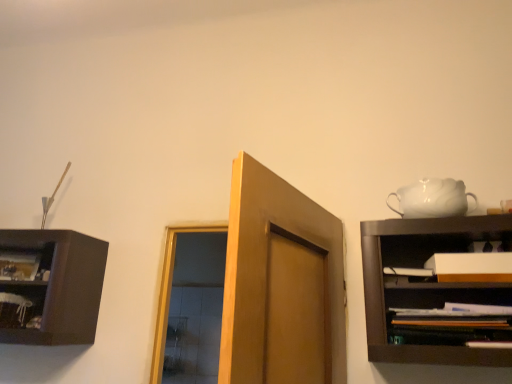
What is the approximate width of white matte cabinet at right?

white matte cabinet at right is 4.28 inches wide.

Identify the location of wooden shelf at right, which is the 2th shelf from left to right. tap(447, 316).

How different are the orientations of wooden shelf at right, which is the 2th shelf from left to right, and white glossy teapot at upper right in degrees?

6.37 degrees.

Between wooden shelf at right, which is the 2th shelf from left to right, and white glossy teapot at upper right, which one is positioned behind?

white glossy teapot at upper right.

Locate an element on the screen. the 1st shelf below when counting from the white glossy teapot at upper right (from the image's perspective) is located at coordinates (447, 316).

From the image's perspective, is wooden shelf at right, placed as the second shelf when sorted from back to front, on top of white glossy teapot at upper right?

Actually, wooden shelf at right, placed as the second shelf when sorted from back to front, appears below white glossy teapot at upper right in the image.

From the image's perspective, which one is positioned higher, wooden shelf at right, which is the 2th shelf from left to right, or wooden shelf at left, which is the 2th shelf from right to left?

wooden shelf at right, which is the 2th shelf from left to right, from the image's perspective.

Can you confirm if wooden shelf at right, which is the 1th shelf in right-to-left order, is shorter than wooden shelf at left, which is the 2th shelf from right to left?

Indeed, wooden shelf at right, which is the 1th shelf in right-to-left order, has a lesser height compared to wooden shelf at left, which is the 2th shelf from right to left.

Is wooden shelf at right, the 1th shelf viewed from the front, in front of or behind wooden shelf at left, acting as the 1th shelf starting from the back, in the image?

wooden shelf at right, the 1th shelf viewed from the front, is positioned closer to the viewer than wooden shelf at left, acting as the 1th shelf starting from the back.

Is wooden shelf at left, which is the 2th shelf from right to left, a part of wooden shelf at right, the 1th shelf viewed from the front?

No, wooden shelf at left, which is the 2th shelf from right to left, is not a part of wooden shelf at right, the 1th shelf viewed from the front.

From the image's perspective, would you say wooden shelf at left, acting as the 1th shelf starting from the back, is positioned over wooden shelf at right, which is the 2th shelf from left to right?

No.

Does wooden shelf at left, which is the second shelf in front-to-back order, have a lesser height compared to wooden shelf at right, which is the 2th shelf from left to right?

Incorrect, the height of wooden shelf at left, which is the second shelf in front-to-back order, does not fall short of that of wooden shelf at right, which is the 2th shelf from left to right.

Would you say wooden shelf at left, which is the 2th shelf from right to left, is outside wooden shelf at right, which is the 1th shelf in right-to-left order?

wooden shelf at left, which is the 2th shelf from right to left, is positioned outside wooden shelf at right, which is the 1th shelf in right-to-left order.

How different are the orientations of wooden shelf at left, which is the 2th shelf from right to left, and wooden shelf at right, placed as the second shelf when sorted from back to front, in degrees?

There is a 1.4-degree angle between the facing directions of wooden shelf at left, which is the 2th shelf from right to left, and wooden shelf at right, placed as the second shelf when sorted from back to front.

Does white glossy teapot at upper right come in front of wooden shelf at right, which is the 2th shelf from left to right?

That is False.

Is white glossy teapot at upper right inside or outside of wooden shelf at right, the 1th shelf viewed from the front?

The correct answer is: outside.

Looking at their sizes, would you say white glossy teapot at upper right is wider or thinner than wooden shelf at right, placed as the second shelf when sorted from back to front?

white glossy teapot at upper right is wider than wooden shelf at right, placed as the second shelf when sorted from back to front.

I want to click on the 1st shelf positioned below the white glossy teapot at upper right (from a real-world perspective), so coord(21,306).

Can you tell me how much white glossy teapot at upper right and wooden shelf at left, which is the 2th shelf from right to left, differ in facing direction?

They differ by 4.97 degrees in their facing directions.

Could you tell me if white glossy teapot at upper right is turned towards wooden shelf at left, acting as the 1th shelf starting from the back?

No, white glossy teapot at upper right is not oriented towards wooden shelf at left, acting as the 1th shelf starting from the back.

From the image's perspective, is wooden shelf at right, which is the 2th shelf from left to right, over white matte cabinet at right?

No, from the image's perspective, wooden shelf at right, which is the 2th shelf from left to right, is not on top of white matte cabinet at right.

From a real-world perspective, between wooden shelf at right, which is the 1th shelf in right-to-left order, and white matte cabinet at right, who is vertically higher?

white matte cabinet at right is physically above.

Which object is positioned more to the right, wooden shelf at right, which is the 1th shelf in right-to-left order, or white matte cabinet at right?

Positioned to the right is white matte cabinet at right.

Between wooden shelf at right, which is the 1th shelf in right-to-left order, and white matte cabinet at right, which one is positioned behind?

white matte cabinet at right.

How many degrees apart are the facing directions of white matte cabinet at right and wooden shelf at right, which is the 2th shelf from left to right?

The angular difference between white matte cabinet at right and wooden shelf at right, which is the 2th shelf from left to right, is 0.000217 degrees.

Does white matte cabinet at right have a smaller size compared to wooden shelf at right, which is the 2th shelf from left to right?

Indeed, white matte cabinet at right has a smaller size compared to wooden shelf at right, which is the 2th shelf from left to right.

Is white matte cabinet at right located outside wooden shelf at right, the 1th shelf viewed from the front?

That's correct, white matte cabinet at right is outside of wooden shelf at right, the 1th shelf viewed from the front.

What are the coordinates of `tea set that is above the wooden shelf at right, placed as the second shelf when sorted from back to front (from a real-world perspective)` in the screenshot? It's located at (432, 199).

This screenshot has height=384, width=512. What are the coordinates of `shelf located underneath the wooden shelf at left, which is the second shelf in front-to-back order (from a real-world perspective)` in the screenshot? It's located at (447, 316).

Based on their spatial positions, is white matte cabinet at right or wooden shelf at left, the 1th shelf from the left, further from wooden shelf at right, the 1th shelf viewed from the front?

wooden shelf at left, the 1th shelf from the left, lies further to wooden shelf at right, the 1th shelf viewed from the front, than the other object.

When comparing their distances from white matte cabinet at right, does wooden shelf at right, which is the 2th shelf from left to right, or white glossy teapot at upper right seem closer?

wooden shelf at right, which is the 2th shelf from left to right, is closer to white matte cabinet at right.

Which object lies nearer to the anchor point wooden shelf at right, placed as the second shelf when sorted from back to front, white glossy teapot at upper right or wooden shelf at left, acting as the 1th shelf starting from the back?

Among the two, white glossy teapot at upper right is located nearer to wooden shelf at right, placed as the second shelf when sorted from back to front.

Which object lies nearer to the anchor point wooden shelf at right, placed as the second shelf when sorted from back to front, wooden shelf at left, which is the 2th shelf from right to left, or white glossy teapot at upper right?

white glossy teapot at upper right is closer to wooden shelf at right, placed as the second shelf when sorted from back to front.

Which object lies nearer to the anchor point wooden shelf at left, which is the 2th shelf from right to left, wooden shelf at right, the 1th shelf viewed from the front, or white glossy teapot at upper right?

Among the two, wooden shelf at right, the 1th shelf viewed from the front, is located nearer to wooden shelf at left, which is the 2th shelf from right to left.

Considering their positions, is white glossy teapot at upper right positioned further to wooden shelf at right, the 1th shelf viewed from the front, than white matte cabinet at right?

Among the two, white glossy teapot at upper right is located further to wooden shelf at right, the 1th shelf viewed from the front.

From the image, which object appears to be farther from white glossy teapot at upper right, wooden shelf at right, the 1th shelf viewed from the front, or wooden shelf at left, which is the 2th shelf from right to left?

Among the two, wooden shelf at left, which is the 2th shelf from right to left, is located further to white glossy teapot at upper right.

Based on their spatial positions, is wooden shelf at left, the 1th shelf from the left, or white matte cabinet at right closer to wooden shelf at right, the 1th shelf viewed from the front?

The object closer to wooden shelf at right, the 1th shelf viewed from the front, is white matte cabinet at right.

At what (x,y) coordinates should I click in order to perform the action: click on cabinet between white glossy teapot at upper right and wooden shelf at right, which is the 1th shelf in right-to-left order, from top to bottom. Please return your answer as a coordinate pair (x, y). This screenshot has width=512, height=384. Looking at the image, I should click on (444, 260).

You are a GUI agent. You are given a task and a screenshot of the screen. Output one action in this format:
    pyautogui.click(x=<x>, y=<y>)
    Task: Click on the tea set between wooden shelf at left, which is the 2th shelf from right to left, and white matte cabinet at right, in the horizontal direction
    This screenshot has width=512, height=384.
    Given the screenshot: What is the action you would take?
    pyautogui.click(x=432, y=199)

Where is `shelf located between wooden shelf at left, which is the 2th shelf from right to left, and white matte cabinet at right in the left-right direction`? This screenshot has height=384, width=512. shelf located between wooden shelf at left, which is the 2th shelf from right to left, and white matte cabinet at right in the left-right direction is located at coordinates (447, 316).

Identify the location of tea set between wooden shelf at left, the 1th shelf from the left, and wooden shelf at right, placed as the second shelf when sorted from back to front. (432, 199).